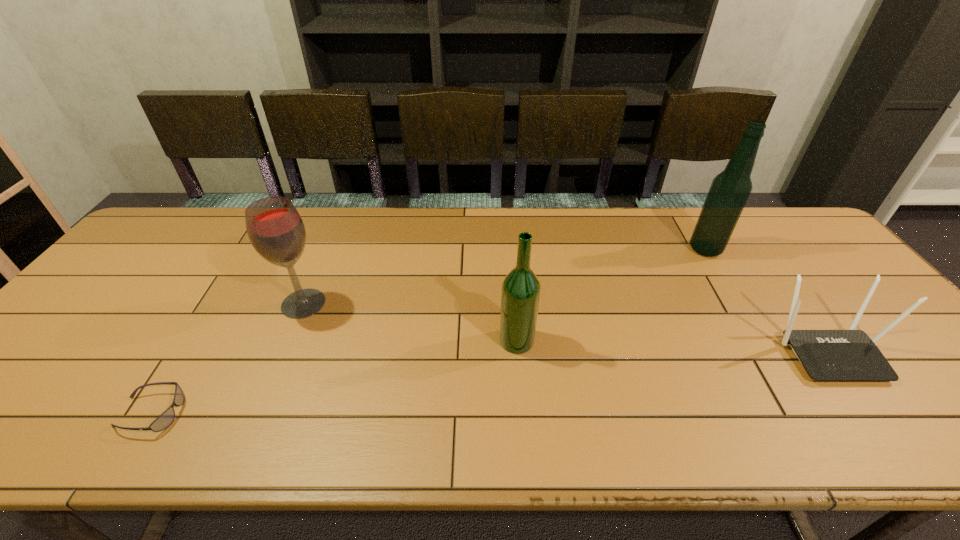
Find the location of a particular element. This screenshot has height=540, width=960. the tallest alcohol is located at coordinates (730, 189).

Where is `the rightmost alcohol`? This screenshot has height=540, width=960. the rightmost alcohol is located at coordinates (730, 189).

Image resolution: width=960 pixels, height=540 pixels. I want to click on the nearest alcohol, so click(x=520, y=294).

Locate an element on the screen. The image size is (960, 540). the third object from left to right is located at coordinates (520, 294).

I want to click on the second nearest alcohol, so click(x=275, y=229).

I want to click on the second object from left to right, so click(x=275, y=229).

The height and width of the screenshot is (540, 960). Find the location of `router`. router is located at coordinates (827, 355).

I want to click on the shortest object, so point(167,417).

Where is `sunglasses`? Image resolution: width=960 pixels, height=540 pixels. sunglasses is located at coordinates (167, 417).

Where is `vacant space situated 0.270m on the left of the farthest alcohol`? The height and width of the screenshot is (540, 960). vacant space situated 0.270m on the left of the farthest alcohol is located at coordinates (601, 249).